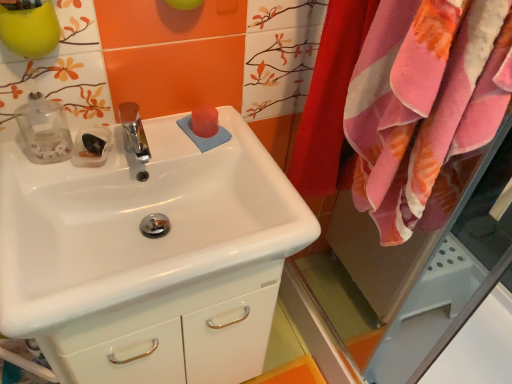
The image size is (512, 384). In order to click on vacant space in white glossy sink at center (from a real-world perspective) in this screenshot , I will do `click(161, 220)`.